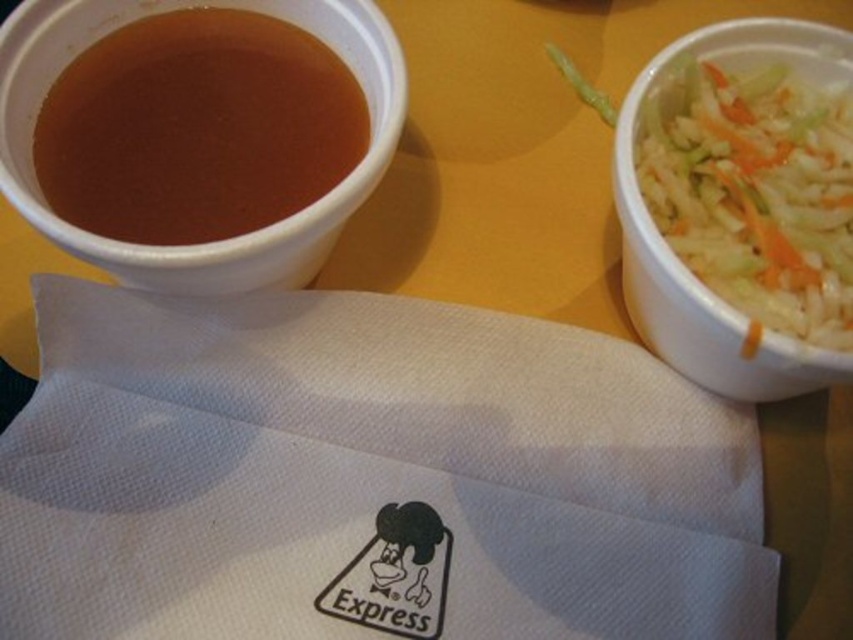
Question: Is brown matte cup at upper left behind white shredded food at right?

Choices:
 (A) no
 (B) yes

Answer: (B)

Question: In this image, where is brown matte cup at upper left located relative to white shredded food at right?

Choices:
 (A) left
 (B) right

Answer: (A)

Question: Is the position of brown matte cup at upper left less distant than that of white shredded food at right?

Choices:
 (A) no
 (B) yes

Answer: (A)